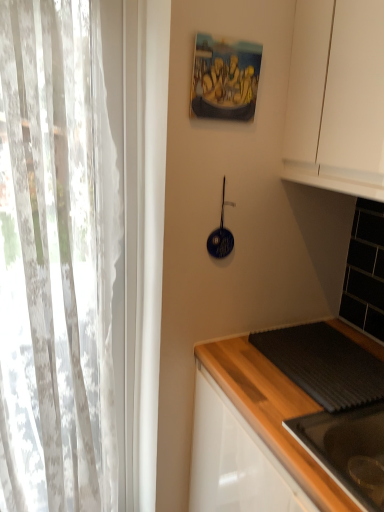
Question: Is white sheer curtain at left smaller than blue glossy frying pan at upper center?

Choices:
 (A) no
 (B) yes

Answer: (A)

Question: From the image's perspective, would you say white sheer curtain at left is shown under blue glossy frying pan at upper center?

Choices:
 (A) yes
 (B) no

Answer: (A)

Question: From a real-world perspective, is white sheer curtain at left located higher than blue glossy frying pan at upper center?

Choices:
 (A) no
 (B) yes

Answer: (A)

Question: Could blue glossy frying pan at upper center be considered to be inside white sheer curtain at left?

Choices:
 (A) no
 (B) yes

Answer: (A)

Question: From the image's perspective, does white sheer curtain at left appear higher than blue glossy frying pan at upper center?

Choices:
 (A) yes
 (B) no

Answer: (B)

Question: Looking at the image, does black glossy sink at lower right seem bigger or smaller compared to blue glossy frying pan at upper center?

Choices:
 (A) big
 (B) small

Answer: (A)

Question: Is black glossy sink at lower right in front of or behind blue glossy frying pan at upper center in the image?

Choices:
 (A) behind
 (B) front

Answer: (B)

Question: In terms of height, does black glossy sink at lower right look taller or shorter compared to blue glossy frying pan at upper center?

Choices:
 (A) tall
 (B) short

Answer: (B)

Question: Considering the relative positions of black glossy sink at lower right and blue glossy frying pan at upper center in the image provided, is black glossy sink at lower right to the left or to the right of blue glossy frying pan at upper center?

Choices:
 (A) right
 (B) left

Answer: (A)

Question: From their relative heights in the image, would you say dark gray textured mat at lower right is taller or shorter than oil painting at upper center?

Choices:
 (A) tall
 (B) short

Answer: (B)

Question: Is dark gray textured mat at lower right in front of or behind oil painting at upper center in the image?

Choices:
 (A) behind
 (B) front

Answer: (B)

Question: Is dark gray textured mat at lower right spatially inside oil painting at upper center, or outside of it?

Choices:
 (A) outside
 (B) inside

Answer: (A)

Question: From the image's perspective, relative to oil painting at upper center, is dark gray textured mat at lower right above or below?

Choices:
 (A) above
 (B) below

Answer: (B)

Question: From the image's perspective, relative to white sheer curtain at left, is black glossy sink at lower right above or below?

Choices:
 (A) above
 (B) below

Answer: (B)

Question: Based on their sizes in the image, would you say black glossy sink at lower right is bigger or smaller than white sheer curtain at left?

Choices:
 (A) big
 (B) small

Answer: (B)